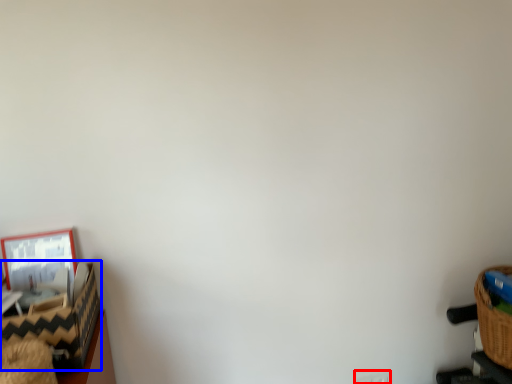
Question: Among these objects, which one is nearest to the camera, electric outlet (highlighted by a red box) or basket (highlighted by a blue box)?

Choices:
 (A) electric outlet
 (B) basket

Answer: (B)